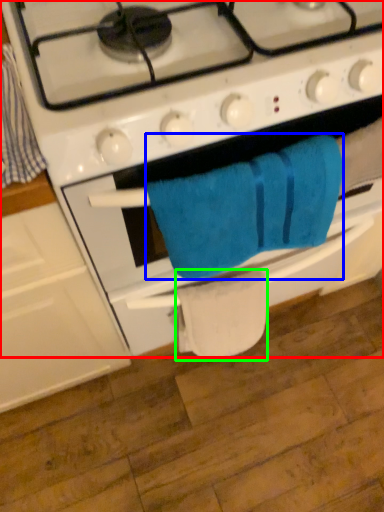
Question: Which object is the farthest from gas stove (highlighted by a red box)? Choose among these: towel/napkin (highlighted by a blue box) or toilet paper (highlighted by a green box).

Choices:
 (A) towel/napkin
 (B) toilet paper

Answer: (B)